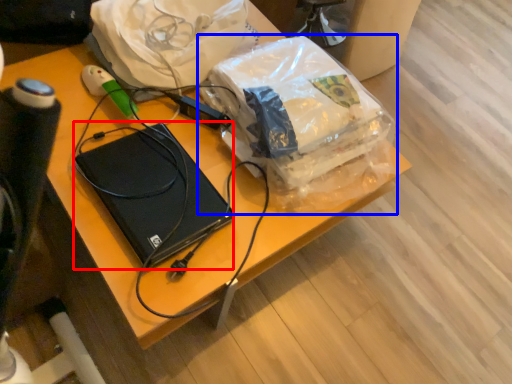
Question: Among these objects, which one is nearest to the camera, computer (highlighted by a red box) or plastic bag (highlighted by a blue box)?

Choices:
 (A) computer
 (B) plastic bag

Answer: (A)